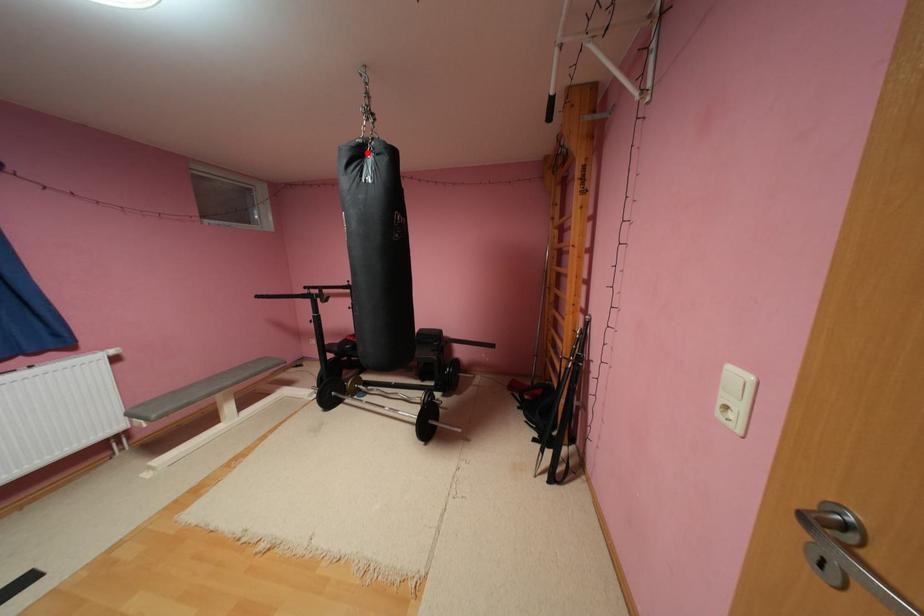
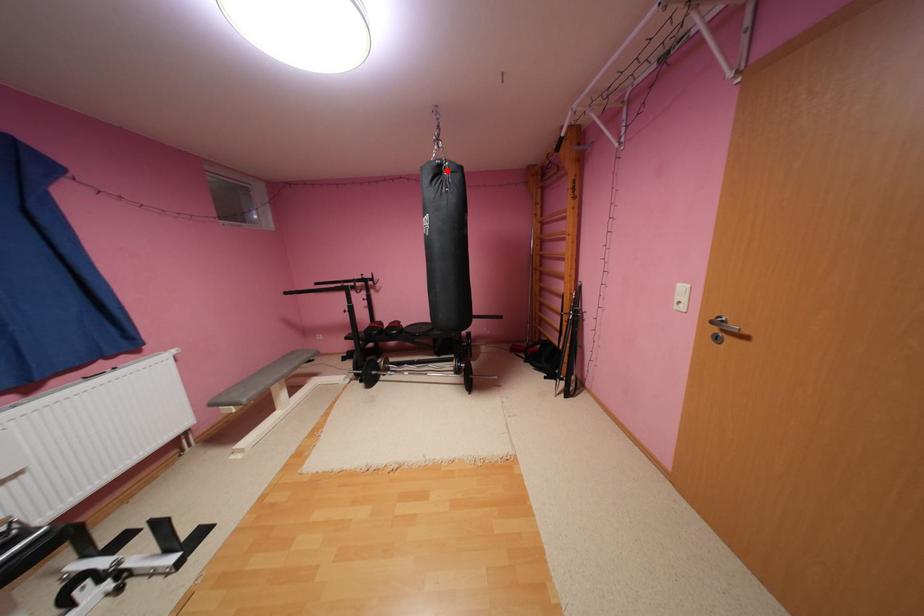
I am providing you with two images of the same scene from different viewpoints. A red point is marked on the first image and another point is marked on the second image. Does the point marked in image1 correspond to the same location as the one in image2?

Yes